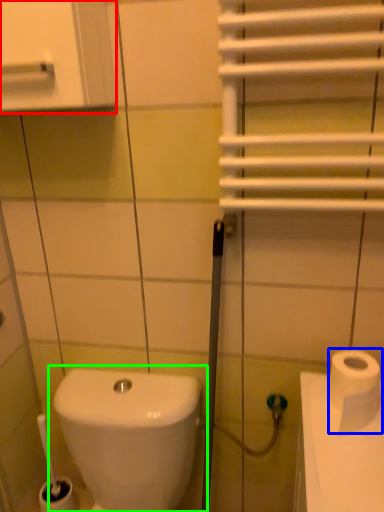
Question: Based on their relative distances, which object is farther from medicine cabinet (highlighted by a red box)? Choose from toilet paper (highlighted by a blue box) and toilet (highlighted by a green box).

Choices:
 (A) toilet paper
 (B) toilet

Answer: (B)